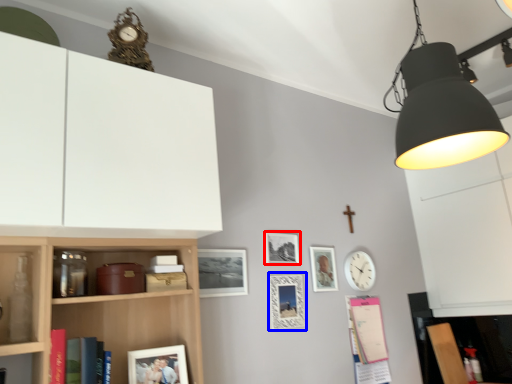
Question: Which of the following is the closest to the observer, picture frame (highlighted by a red box) or picture frame (highlighted by a blue box)?

Choices:
 (A) picture frame
 (B) picture frame

Answer: (B)